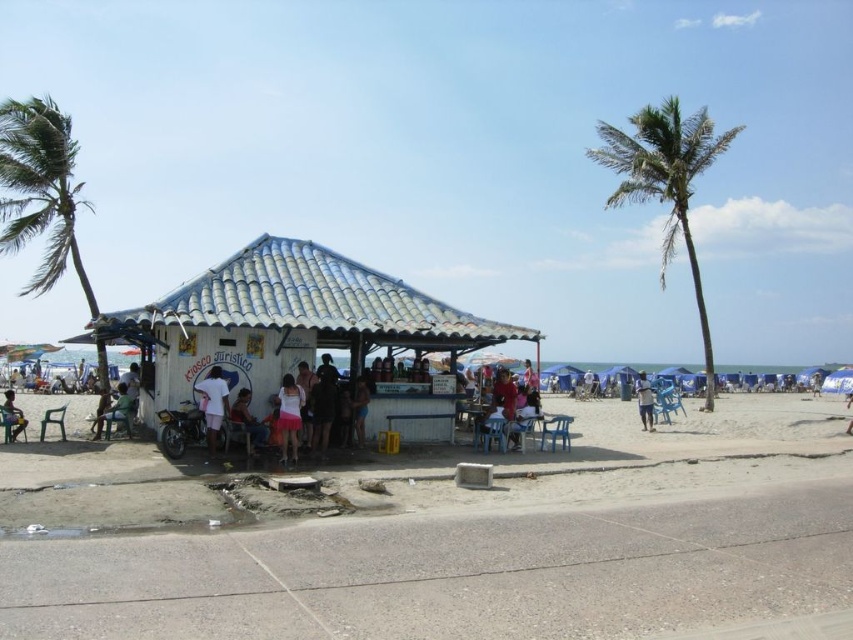
You are standing at the entrance of the Kiosco Juristico and want to sit at the blue plastic picnic table at center. In which direction should you walk relative to the kiosk?

Since the blue plastic picnic table at center is located at coordinates (x=521, y=429), you should walk towards the center of the scene from the kiosk to reach it.

You are a photographer trying to capture both the white fabric skirt at center and the blue fabric shorts at lower right in the same frame. Considering their sizes, which one should you zoom in on to ensure both fit clearly in the photo?

Since the white fabric skirt at center is smaller than the blue fabric shorts at lower right, you should zoom out to include both in the frame rather than zooming in. Zooming in might cause the larger blue fabric shorts at lower right to be too big for the frame.